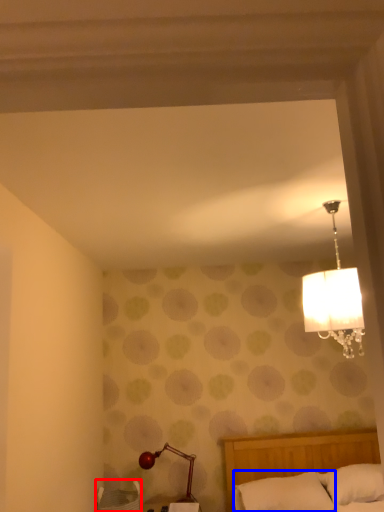
Question: Which object is further to the camera taking this photo, furniture (highlighted by a red box) or pillow (highlighted by a blue box)?

Choices:
 (A) furniture
 (B) pillow

Answer: (A)